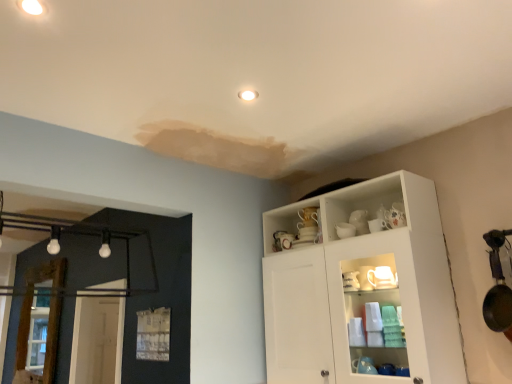
Question: From a real-world perspective, is wooden screen door at left physically located above or below white matte cabinet at upper right?

Choices:
 (A) above
 (B) below

Answer: (B)

Question: In the image, is wooden screen door at left positioned in front of or behind white matte cabinet at upper right?

Choices:
 (A) front
 (B) behind

Answer: (B)

Question: Does point (61, 301) appear closer or farther from the camera than point (266, 228)?

Choices:
 (A) closer
 (B) farther

Answer: (B)

Question: From their relative heights in the image, would you say white matte cabinet at upper right is taller or shorter than wooden screen door at left?

Choices:
 (A) tall
 (B) short

Answer: (A)

Question: Is white matte cabinet at upper right to the left or to the right of wooden screen door at left in the image?

Choices:
 (A) right
 (B) left

Answer: (A)

Question: Looking at the image, does white matte cabinet at upper right seem bigger or smaller compared to wooden screen door at left?

Choices:
 (A) big
 (B) small

Answer: (A)

Question: Do you think white matte cabinet at upper right is within wooden screen door at left, or outside of it?

Choices:
 (A) inside
 (B) outside

Answer: (B)